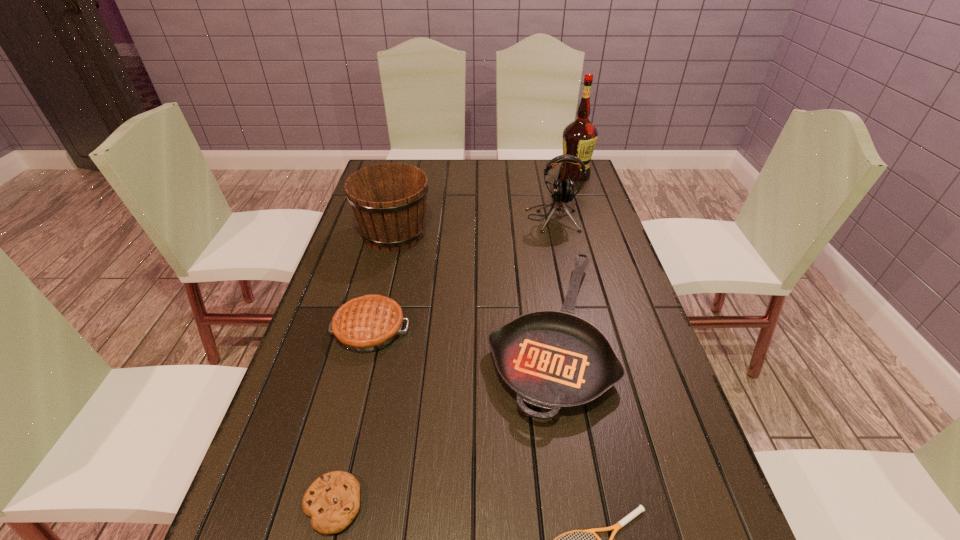
At what (x,y) coordinates should I click in order to perform the action: click on the tallest object. Please return your answer as a coordinate pair (x, y). The height and width of the screenshot is (540, 960). Looking at the image, I should click on (579, 137).

Locate an element on the screen. The image size is (960, 540). alcohol is located at coordinates (579, 137).

The height and width of the screenshot is (540, 960). Find the location of `the sixth shortest object`. the sixth shortest object is located at coordinates (562, 190).

I want to click on the fifth shortest object, so click(389, 199).

I want to click on pie, so click(368, 323).

You are a GUI agent. You are given a task and a screenshot of the screen. Output one action in this format:
    pyautogui.click(x=<x>, y=<y>)
    Task: Click on the fifth tallest object
    
    Given the screenshot: What is the action you would take?
    pyautogui.click(x=554, y=360)

This screenshot has height=540, width=960. I want to click on the second shortest object, so click(x=332, y=501).

I want to click on vacant area located on the label of the farthest object, so click(x=581, y=193).

The width and height of the screenshot is (960, 540). Find the location of `vacant space located 0.330m on the back of the sixth shortest object`. vacant space located 0.330m on the back of the sixth shortest object is located at coordinates (540, 163).

The image size is (960, 540). I want to click on vacant space located on the back of the wine bucket, so click(403, 197).